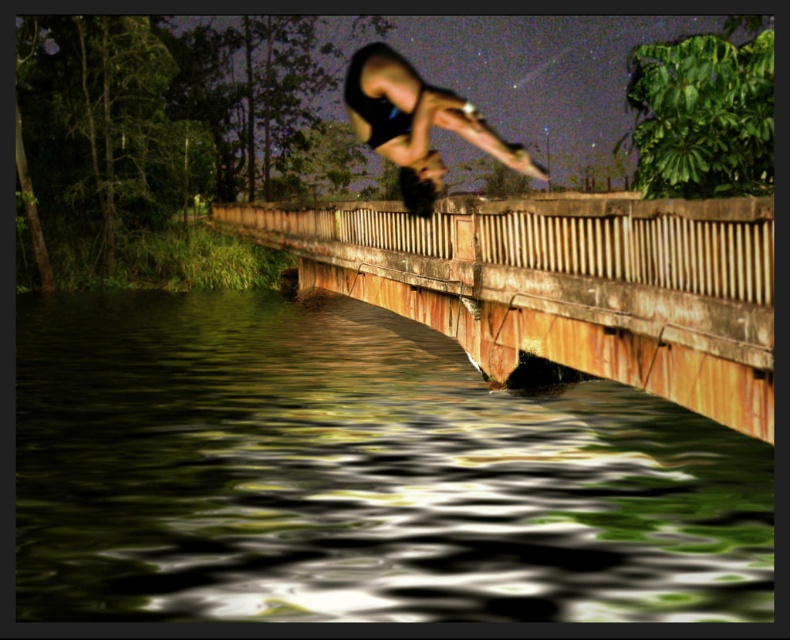
Question: From the image, what is the correct spatial relationship of green reflective water at lower left in relation to black matte man at center?

Choices:
 (A) right
 (B) left

Answer: (B)

Question: Which point is closer to the camera?

Choices:
 (A) green reflective water at lower left
 (B) rusty metal bridge at center

Answer: (A)

Question: Is rusty metal bridge at center behind black matte man at center?

Choices:
 (A) yes
 (B) no

Answer: (A)

Question: Is green reflective water at lower left below rusty metal bridge at center?

Choices:
 (A) yes
 (B) no

Answer: (A)

Question: Which object appears closest to the camera in this image?

Choices:
 (A) black matte man at center
 (B) rusty metal bridge at center
 (C) green reflective water at lower left

Answer: (C)

Question: Which point is closer to the camera?

Choices:
 (A) (723, 406)
 (B) (743, 602)
 (C) (431, 176)

Answer: (B)